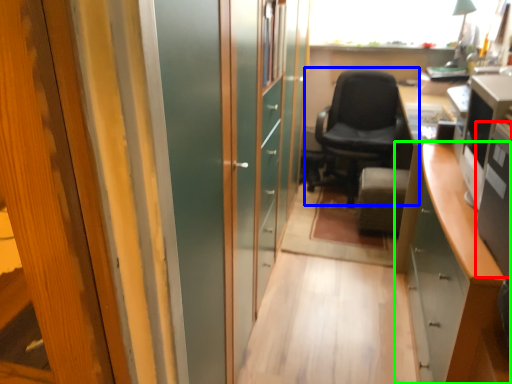
Question: Which object is positioned farthest from desktop computer (highlighted by a red box)? Select from chair (highlighted by a blue box) and cabinetry (highlighted by a green box).

Choices:
 (A) chair
 (B) cabinetry

Answer: (A)